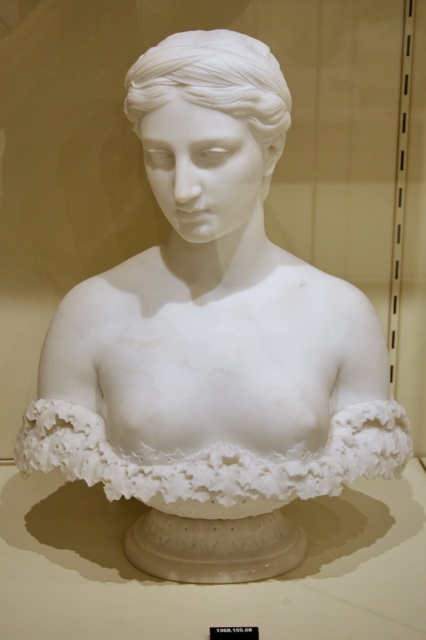
Who is lower down, white marble ruffle at center or white marble bust at center?

white marble ruffle at center

Is white marble ruffle at center to the right of white marble bust at center from the viewer's perspective?

Incorrect, white marble ruffle at center is not on the right side of white marble bust at center.

Between point (244, 472) and point (242, 100), which one is positioned behind?

Positioned behind is point (244, 472).

Where is `white marble ruffle at center`? Image resolution: width=426 pixels, height=640 pixels. white marble ruffle at center is located at coordinates (215, 458).